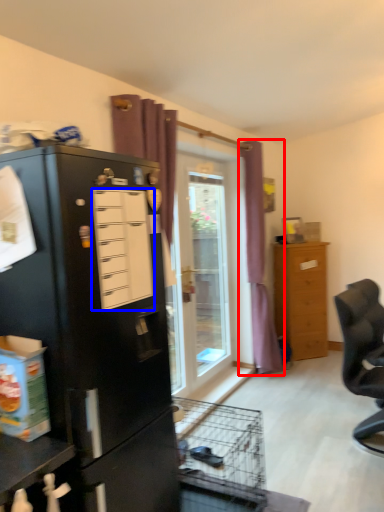
Question: Which of the following is the closest to the observer, curtain (highlighted by a red box) or drawer (highlighted by a blue box)?

Choices:
 (A) curtain
 (B) drawer

Answer: (B)